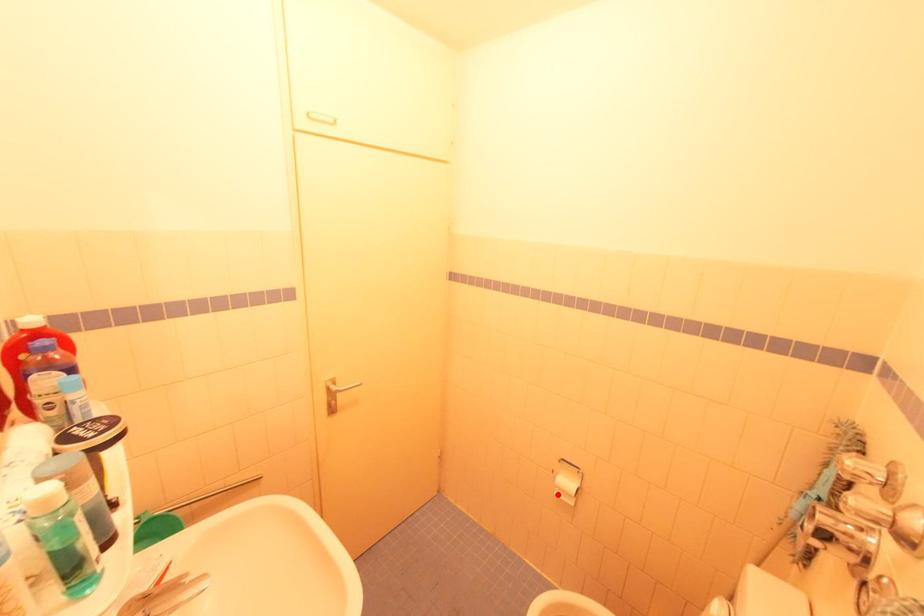
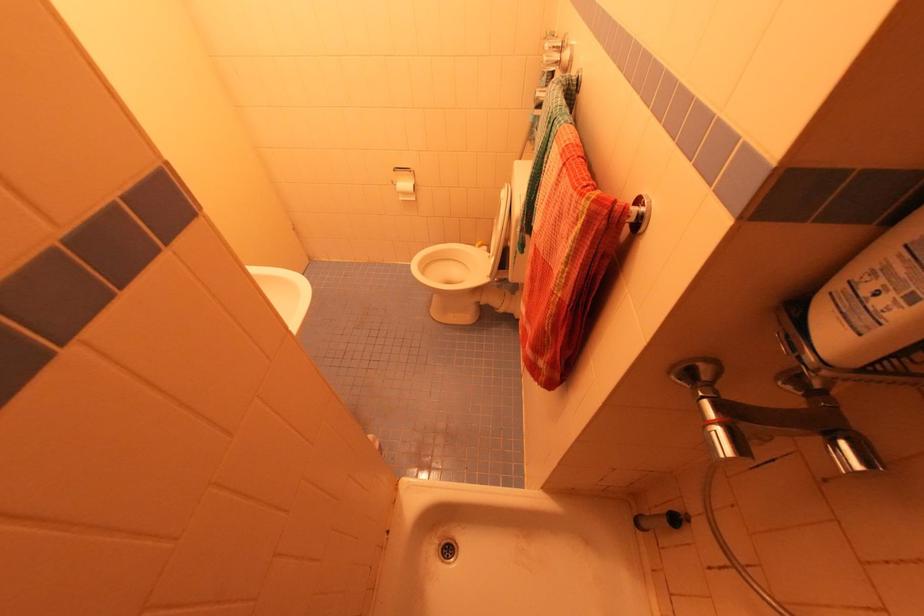
Locate, in the second image, the point that corresponds to the highlighted location in the first image.

(403, 200)